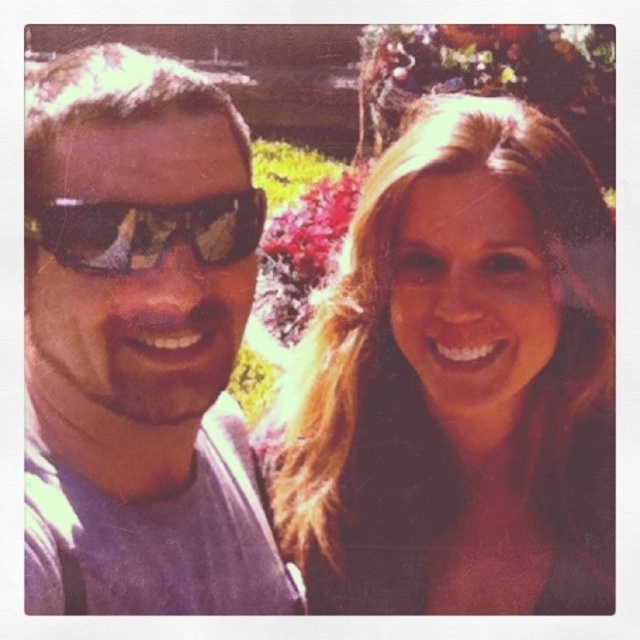
You are a photographer trying to capture the woman with long blonde hair in the center of the image. The camera is set to focus on the point at coordinates point [458,381]. Will this point be effective for focusing on the woman with long blonde hair?

Yes, the point [458,381] is effective because the blonde hair at center is located at that point, so focusing there will capture the woman with long blonde hair clearly.

Looking at this image, you are a photographer trying to capture a closeup of the blonde hair at center and the black reflective sunglasses at left. Which object should you zoom in on to ensure both are in frame without moving the camera?

The blonde hair at center has a larger size compared to the black reflective sunglasses at left, so you should zoom in on the blonde hair at center to ensure both are in frame without moving the camera.

You are a photographer trying to adjust the lighting for a photo shoot. You notice the matte gray shirt at left and the black reflective sunglasses at left in the frame. Which object should you focus your lighting adjustments on to ensure proper exposure, considering their size in the frame?

The matte gray shirt at left has a greater height compared to the black reflective sunglasses at left, so you should focus your lighting adjustments on the matte gray shirt at left since it is larger and may require more balanced lighting to ensure proper exposure.